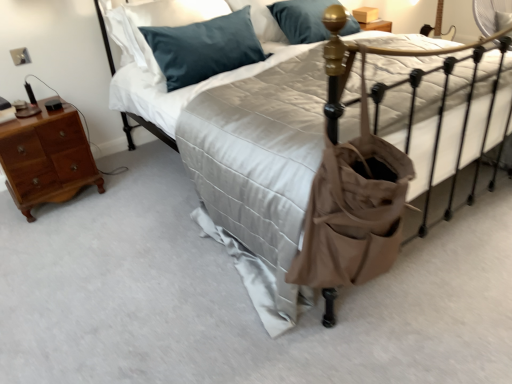
What do you see at coordinates (170, 19) in the screenshot? The image size is (512, 384). I see `teal fabric pillow at upper left, placed as the 1th pillow when sorted from back to front` at bounding box center [170, 19].

In order to face matte beige bed at center, should I rotate leftwards or rightwards?

Turn right by 13.766 degrees to look at matte beige bed at center.

This screenshot has height=384, width=512. Describe the element at coordinates (46, 158) in the screenshot. I see `light brown wood nightstand at left` at that location.

What are the coordinates of `matte brown tote at center` in the screenshot? It's located at (353, 209).

Measure the distance between satin blue pillow at upper center, arranged as the first pillow when viewed from the front, and camera.

Answer: The depth of satin blue pillow at upper center, arranged as the first pillow when viewed from the front, is 2.00 meters.

Find the location of `teal fabric pillow at upper left, the second pillow viewed from the front`. teal fabric pillow at upper left, the second pillow viewed from the front is located at coordinates (170, 19).

Considering the relative sizes of matte beige bed at center and matte brown tote at center in the image provided, is matte beige bed at center taller than matte brown tote at center?

Yes, matte beige bed at center is taller than matte brown tote at center.

What are the coordinates of `bed located underneath the matte brown tote at center (from a real-world perspective)` in the screenshot? It's located at click(x=255, y=179).

Is matte beige bed at center looking in the opposite direction of matte brown tote at center?

No, matte brown tote at center is not at the back of matte beige bed at center.

From a real-world perspective, is matte beige bed at center positioned under matte brown tote at center based on gravity?

Yes, from a real-world perspective, matte beige bed at center is below matte brown tote at center.

Is matte beige bed at center in front of or behind satin blue pillow at upper center, placed as the second pillow when sorted from back to front, in the image?

matte beige bed at center is in front of satin blue pillow at upper center, placed as the second pillow when sorted from back to front.

Is matte beige bed at center wider than satin blue pillow at upper center, arranged as the first pillow when viewed from the front?

Correct, the width of matte beige bed at center exceeds that of satin blue pillow at upper center, arranged as the first pillow when viewed from the front.

Is matte beige bed at center next to satin blue pillow at upper center, placed as the second pillow when sorted from back to front, and touching it?

matte beige bed at center and satin blue pillow at upper center, placed as the second pillow when sorted from back to front, are clearly separated.

In the scene shown: From the image's perspective, between satin blue pillow at upper center, arranged as the first pillow when viewed from the front, and matte brown tote at center, which one is located above?

satin blue pillow at upper center, arranged as the first pillow when viewed from the front, appears higher in the image.

Are satin blue pillow at upper center, arranged as the first pillow when viewed from the front, and matte brown tote at center making contact?

No, satin blue pillow at upper center, arranged as the first pillow when viewed from the front, is not next to matte brown tote at center.

Considering the relative sizes of satin blue pillow at upper center, placed as the second pillow when sorted from back to front, and matte brown tote at center in the image provided, is satin blue pillow at upper center, placed as the second pillow when sorted from back to front, shorter than matte brown tote at center?

Yes, satin blue pillow at upper center, placed as the second pillow when sorted from back to front, is shorter than matte brown tote at center.

Is satin blue pillow at upper center, arranged as the first pillow when viewed from the front, located outside matte brown tote at center?

Absolutely, satin blue pillow at upper center, arranged as the first pillow when viewed from the front, is external to matte brown tote at center.

Does satin blue pillow at upper center, placed as the second pillow when sorted from back to front, have a greater width compared to light brown wood nightstand at left?

Yes.

Between satin blue pillow at upper center, placed as the second pillow when sorted from back to front, and light brown wood nightstand at left, which one appears on the right side from the viewer's perspective?

satin blue pillow at upper center, placed as the second pillow when sorted from back to front, is more to the right.

Which object is closer to the camera, satin blue pillow at upper center, placed as the second pillow when sorted from back to front, or light brown wood nightstand at left?

satin blue pillow at upper center, placed as the second pillow when sorted from back to front, is more forward.

Would you consider teal fabric pillow at upper left, placed as the 1th pillow when sorted from back to front, to be distant from satin blue pillow at upper center, arranged as the first pillow when viewed from the front?

That's not correct — teal fabric pillow at upper left, placed as the 1th pillow when sorted from back to front, is a little close to satin blue pillow at upper center, arranged as the first pillow when viewed from the front.

Is teal fabric pillow at upper left, the second pillow viewed from the front, at the left side of satin blue pillow at upper center, arranged as the first pillow when viewed from the front?

Yes, teal fabric pillow at upper left, the second pillow viewed from the front, is to the left of satin blue pillow at upper center, arranged as the first pillow when viewed from the front.

Does teal fabric pillow at upper left, placed as the 1th pillow when sorted from back to front, lie behind satin blue pillow at upper center, arranged as the first pillow when viewed from the front?

Yes, it is behind satin blue pillow at upper center, arranged as the first pillow when viewed from the front.

Who is taller, teal fabric pillow at upper left, the second pillow viewed from the front, or satin blue pillow at upper center, arranged as the first pillow when viewed from the front?

satin blue pillow at upper center, arranged as the first pillow when viewed from the front.

The width and height of the screenshot is (512, 384). What are the coordinates of `pillow that appears below the teal fabric pillow at upper left, the second pillow viewed from the front (from the image's perspective)` in the screenshot? It's located at [x=204, y=48].

Considering the positions of objects satin blue pillow at upper center, arranged as the first pillow when viewed from the front, and teal fabric pillow at upper left, placed as the 1th pillow when sorted from back to front, in the image provided, who is more to the right, satin blue pillow at upper center, arranged as the first pillow when viewed from the front, or teal fabric pillow at upper left, placed as the 1th pillow when sorted from back to front,?

satin blue pillow at upper center, arranged as the first pillow when viewed from the front.

Considering the sizes of objects satin blue pillow at upper center, arranged as the first pillow when viewed from the front, and teal fabric pillow at upper left, placed as the 1th pillow when sorted from back to front, in the image provided, who is smaller, satin blue pillow at upper center, arranged as the first pillow when viewed from the front, or teal fabric pillow at upper left, placed as the 1th pillow when sorted from back to front,?

teal fabric pillow at upper left, placed as the 1th pillow when sorted from back to front.

From a real-world perspective, which object rests below the other?

From a 3D spatial view, satin blue pillow at upper center, arranged as the first pillow when viewed from the front, is below.

Can you confirm if matte brown tote at center is positioned to the right of satin blue pillow at upper center, placed as the second pillow when sorted from back to front?

Correct, you'll find matte brown tote at center to the right of satin blue pillow at upper center, placed as the second pillow when sorted from back to front.

Considering the sizes of objects matte brown tote at center and satin blue pillow at upper center, placed as the second pillow when sorted from back to front, in the image provided, who is thinner, matte brown tote at center or satin blue pillow at upper center, placed as the second pillow when sorted from back to front,?

With smaller width is matte brown tote at center.

Is matte brown tote at center behind satin blue pillow at upper center, placed as the second pillow when sorted from back to front?

No, the depth of matte brown tote at center is less than that of satin blue pillow at upper center, placed as the second pillow when sorted from back to front.

Considering the sizes of matte brown tote at center and satin blue pillow at upper center, arranged as the first pillow when viewed from the front, in the image, is matte brown tote at center taller or shorter than satin blue pillow at upper center, arranged as the first pillow when viewed from the front,?

Considering their sizes, matte brown tote at center has more height than satin blue pillow at upper center, arranged as the first pillow when viewed from the front.

Where is `bag below the matte beige bed at center (from the image's perspective)`? bag below the matte beige bed at center (from the image's perspective) is located at coordinates (353, 209).

The height and width of the screenshot is (384, 512). I want to click on pillow that is the 1st object to the left of the matte beige bed at center, starting at the anchor, so click(204, 48).

Based on their spatial positions, is matte brown tote at center or matte beige bed at center closer to satin blue pillow at upper center, arranged as the first pillow when viewed from the front?

The object closer to satin blue pillow at upper center, arranged as the first pillow when viewed from the front, is matte beige bed at center.

Looking at the image, which one is located closer to light brown wood nightstand at left, matte brown tote at center or satin blue pillow at upper center, arranged as the first pillow when viewed from the front?

Among the two, satin blue pillow at upper center, arranged as the first pillow when viewed from the front, is located nearer to light brown wood nightstand at left.

Which object lies nearer to the anchor point light brown wood nightstand at left, satin blue pillow at upper center, arranged as the first pillow when viewed from the front, or matte brown tote at center?

satin blue pillow at upper center, arranged as the first pillow when viewed from the front, lies closer to light brown wood nightstand at left than the other object.

From the image, which object appears to be nearer to matte brown tote at center, teal fabric pillow at upper left, placed as the 1th pillow when sorted from back to front, or satin blue pillow at upper center, arranged as the first pillow when viewed from the front?

satin blue pillow at upper center, arranged as the first pillow when viewed from the front, is closer to matte brown tote at center.

From the image, which object appears to be farther from teal fabric pillow at upper left, placed as the 1th pillow when sorted from back to front, light brown wood nightstand at left or matte brown tote at center?

Based on the image, matte brown tote at center appears to be further to teal fabric pillow at upper left, placed as the 1th pillow when sorted from back to front.

When comparing their distances from matte brown tote at center, does satin blue pillow at upper center, arranged as the first pillow when viewed from the front, or matte beige bed at center seem closer?

The object closer to matte brown tote at center is matte beige bed at center.

Looking at this image, from the image, which object appears to be farther from matte beige bed at center, teal fabric pillow at upper left, the second pillow viewed from the front, or satin blue pillow at upper center, placed as the second pillow when sorted from back to front?

Among the two, teal fabric pillow at upper left, the second pillow viewed from the front, is located further to matte beige bed at center.

Estimate the real-world distances between objects in this image. Which object is closer to matte brown tote at center, satin blue pillow at upper center, arranged as the first pillow when viewed from the front, or teal fabric pillow at upper left, the second pillow viewed from the front?

satin blue pillow at upper center, arranged as the first pillow when viewed from the front.

Locate an element on the screen. This screenshot has height=384, width=512. pillow between light brown wood nightstand at left and satin blue pillow at upper center, placed as the second pillow when sorted from back to front, from left to right is located at coordinates (170, 19).

You are a GUI agent. You are given a task and a screenshot of the screen. Output one action in this format:
    pyautogui.click(x=<x>, y=<y>)
    Task: Click on the bag between light brown wood nightstand at left and matte beige bed at center in the horizontal direction
    The height and width of the screenshot is (384, 512).
    Given the screenshot: What is the action you would take?
    (x=353, y=209)

Where is `bed between matte brown tote at center and teal fabric pillow at upper left, placed as the 1th pillow when sorted from back to front, along the z-axis`? bed between matte brown tote at center and teal fabric pillow at upper left, placed as the 1th pillow when sorted from back to front, along the z-axis is located at coordinates (255, 179).

Where is `pillow between matte brown tote at center and teal fabric pillow at upper left, placed as the 1th pillow when sorted from back to front, from front to back`? Image resolution: width=512 pixels, height=384 pixels. pillow between matte brown tote at center and teal fabric pillow at upper left, placed as the 1th pillow when sorted from back to front, from front to back is located at coordinates (204, 48).